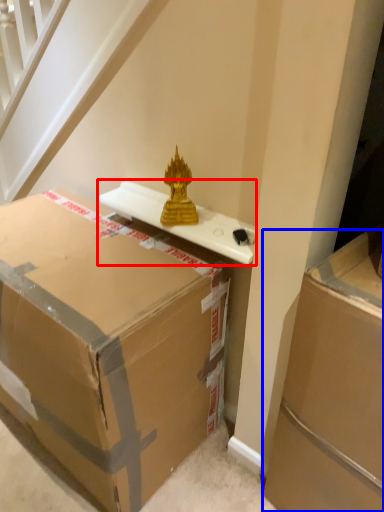
Question: Which object appears farthest to the camera in this image, table (highlighted by a red box) or box (highlighted by a blue box)?

Choices:
 (A) table
 (B) box

Answer: (A)